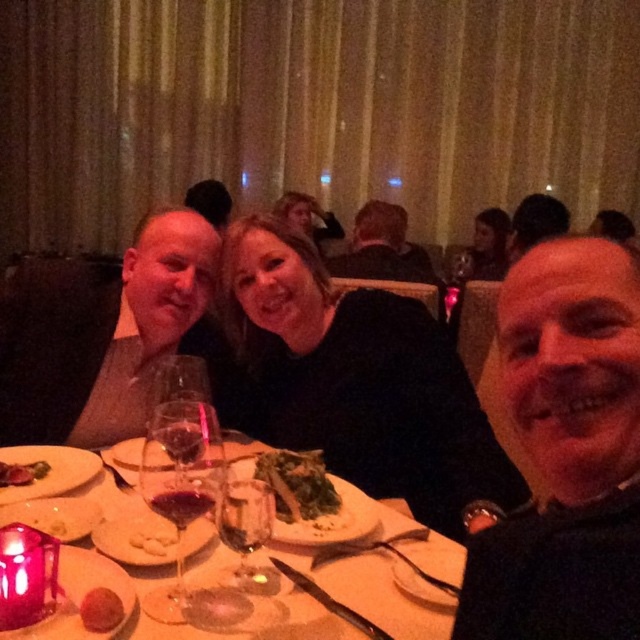
Who is shorter, matte glass plate at center or matte white plate at lower left?

With less height is matte glass plate at center.

Is point (76, 632) farther from camera compared to point (83, 468)?

No, (76, 632) is closer to viewer.

The width and height of the screenshot is (640, 640). Identify the location of matte glass plate at center. (81, 596).

Is point (227, 493) positioned behind point (138, 529)?

No, it is in front of (138, 529).

Between transparent glass at center and white creamy mashed potatoes at center, which one appears on the left side from the viewer's perspective?

white creamy mashed potatoes at center

This screenshot has height=640, width=640. Find the location of `transparent glass at center`. transparent glass at center is located at coordinates (246, 531).

Does black matte dress at center appear under transparent glass wine glass at center?

Actually, black matte dress at center is above transparent glass wine glass at center.

Who is positioned more to the left, black matte dress at center or transparent glass wine glass at center?

Positioned to the left is transparent glass wine glass at center.

This screenshot has width=640, height=640. I want to click on black matte dress at center, so click(x=358, y=380).